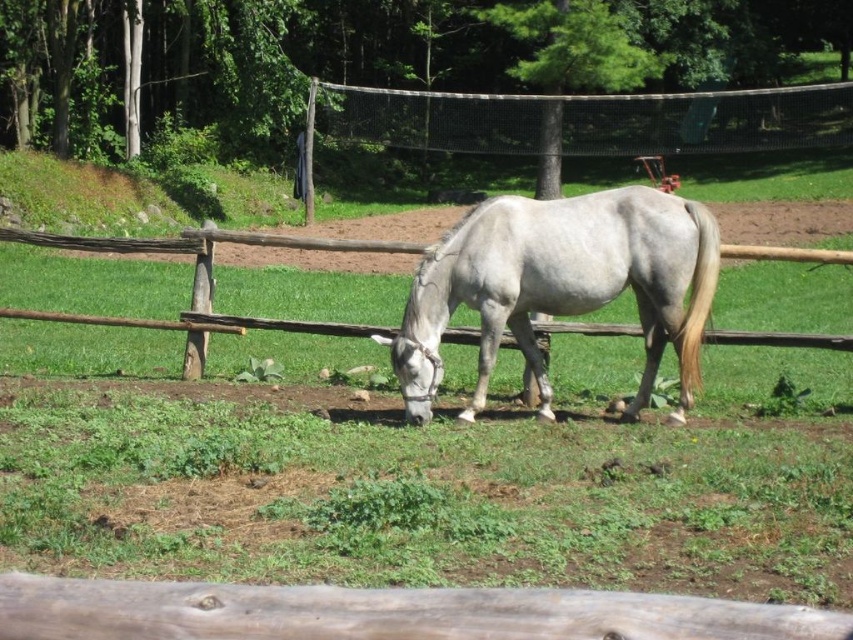
Question: Is white matte horse at center smaller than black mesh fence at upper center?

Choices:
 (A) no
 (B) yes

Answer: (B)

Question: Which point appears closest to the camera in this image?

Choices:
 (A) (397, 348)
 (B) (605, 144)

Answer: (A)

Question: Does white matte horse at center have a lesser width compared to black mesh fence at upper center?

Choices:
 (A) yes
 (B) no

Answer: (A)

Question: Does white matte horse at center appear under black mesh fence at upper center?

Choices:
 (A) no
 (B) yes

Answer: (B)